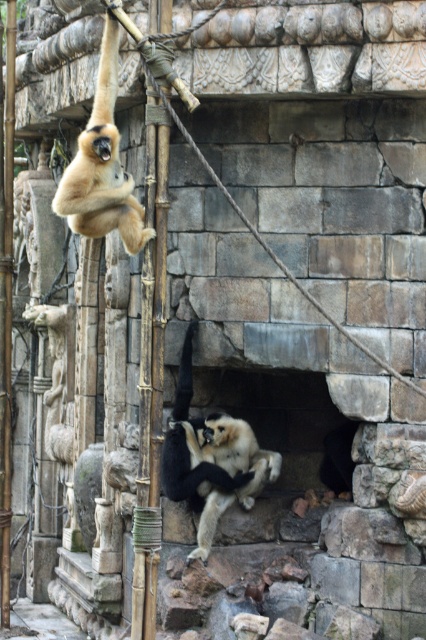
Who is lower down, bamboo pole at left or light beige fur at center?

light beige fur at center is lower down.

Is point (147, 634) closer to viewer compared to point (170, 493)?

Yes, it is.

Where is `bamboo pole at left`? The image size is (426, 640). bamboo pole at left is located at coordinates (152, 320).

What do you see at coordinates (152, 320) in the screenshot? This screenshot has width=426, height=640. I see `bamboo pole at left` at bounding box center [152, 320].

Does bamboo pole at left appear under bamboo pole at center?

Correct, bamboo pole at left is located below bamboo pole at center.

Who is more forward, (146,372) or (6,349)?

Positioned in front is point (146,372).

This screenshot has height=640, width=426. Find the location of `bamboo pole at left`. bamboo pole at left is located at coordinates (152, 320).

Can you confirm if light beige fur at upper left is positioned below bamboo pole at center?

No.

The width and height of the screenshot is (426, 640). What do you see at coordinates (101, 164) in the screenshot?
I see `light beige fur at upper left` at bounding box center [101, 164].

This screenshot has height=640, width=426. In order to click on light beige fur at upper left in this screenshot , I will do `click(101, 164)`.